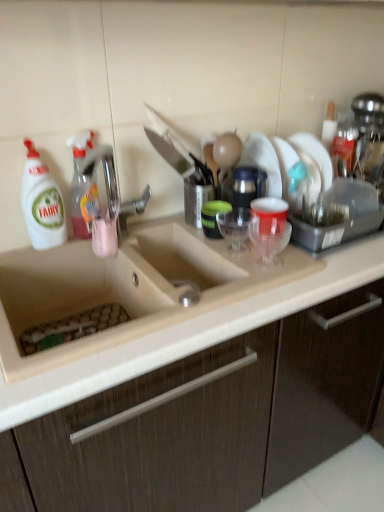
This screenshot has height=512, width=384. In order to click on free point to the right of transparent plastic cup at center, which is the second tableware in left-to-right order in this screenshot , I will do `click(299, 264)`.